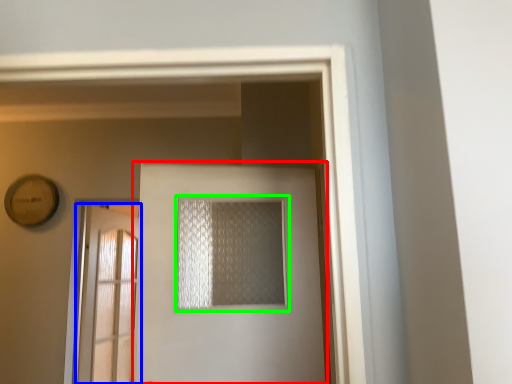
Question: Which object is positioned closest to door (highlighted by a red box)? Select from door (highlighted by a blue box) and window (highlighted by a green box).

Choices:
 (A) door
 (B) window

Answer: (B)